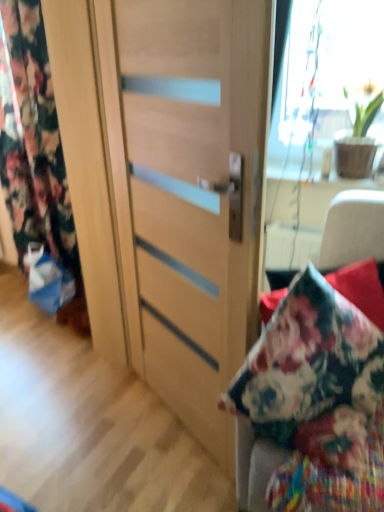
Question: Is green matte plant at upper right positioned in front of matte wood door at center?

Choices:
 (A) no
 (B) yes

Answer: (A)

Question: Is green matte plant at upper right surrounding matte wood door at center?

Choices:
 (A) yes
 (B) no

Answer: (B)

Question: Is green matte plant at upper right beside matte wood door at center?

Choices:
 (A) yes
 (B) no

Answer: (B)

Question: Can we say green matte plant at upper right lies outside matte wood door at center?

Choices:
 (A) yes
 (B) no

Answer: (A)

Question: Would you consider green matte plant at upper right to be distant from matte wood door at center?

Choices:
 (A) no
 (B) yes

Answer: (A)

Question: Is green matte plant at upper right to the right of matte wood door at center from the viewer's perspective?

Choices:
 (A) yes
 (B) no

Answer: (A)

Question: From the image's perspective, would you say matte wood door at center is positioned over green matte plant at upper right?

Choices:
 (A) yes
 (B) no

Answer: (B)

Question: Is matte wood door at center further to the viewer compared to green matte plant at upper right?

Choices:
 (A) no
 (B) yes

Answer: (A)

Question: From a real-world perspective, is matte wood door at center located beneath green matte plant at upper right?

Choices:
 (A) yes
 (B) no

Answer: (A)

Question: From a real-world perspective, is matte wood door at center on top of green matte plant at upper right?

Choices:
 (A) yes
 (B) no

Answer: (B)

Question: Is matte wood door at center positioned far away from green matte plant at upper right?

Choices:
 (A) yes
 (B) no

Answer: (B)

Question: Is matte wood door at center wider than green matte plant at upper right?

Choices:
 (A) no
 (B) yes

Answer: (A)

Question: Does floral fabric curtain at left lie in front of wooden cabinet at center?

Choices:
 (A) no
 (B) yes

Answer: (A)